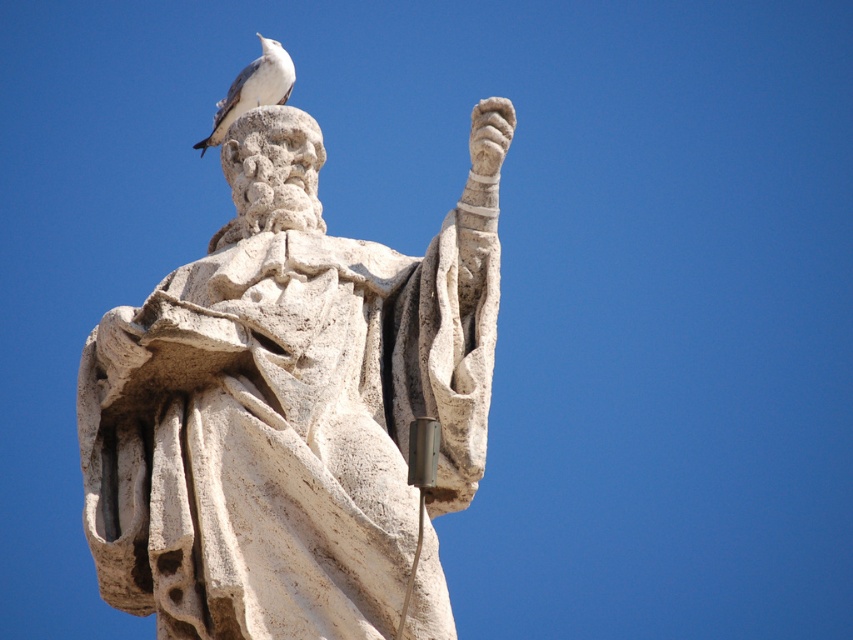
Is point (221, 570) closer to viewer compared to point (260, 74)?

That is True.

Does white stone statue at center lie in front of white stone bird at top?

Yes, it is in front of white stone bird at top.

Locate an element on the screen. white stone statue at center is located at coordinates (291, 406).